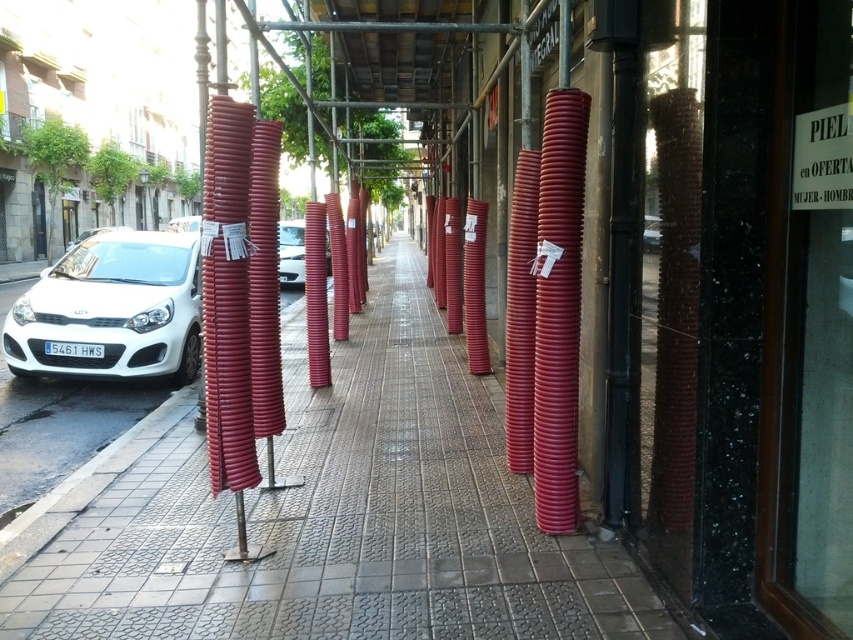
From the picture: You are standing on the sidewalk and want to take a photo of the white car parked on the left. There are two points marked on the sidewalk at coordinates point (167, 266) and point (646, 220). Which point should you stand at to ensure the white car is fully visible in your photo without any obstructions from the stacked red cylindrical covers?

You should stand at point (167, 266) because it is closer to the camera compared to point (646, 220), allowing for a clearer view of the white car without obstructions from the stacked red cylindrical covers.

You are standing on the sidewalk and see two points marked on the ground. One is at point coordinates point [287,264] and the other is at point [648,243]. Which point is closer to you?

The point at coordinates point [287,264] is closer to you because it is further to the viewer than point [648,243].

Looking at this image, you are a delivery person who needs to park a van that is 2 meters wide. There is a parking spot between the white matte car at left and the metallic silver car at center. Can you fit your van in this space?

The white matte car at left is wider than the metallic silver car at center. However, the width of the cars themselves doesn not directly determine the available space between them. To determine if the van can fit, you would need to measure the distance between the two cars. Since the description only provides information about their widths, it is unclear if the space between them is sufficient for a 2 meter wide van.